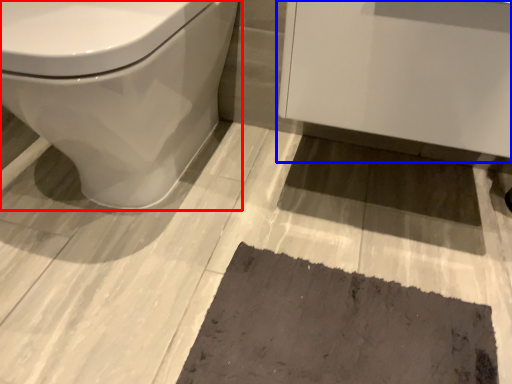
Question: Among these objects, which one is nearest to the camera, toilet (highlighted by a red box) or porcelain (highlighted by a blue box)?

Choices:
 (A) toilet
 (B) porcelain

Answer: (A)